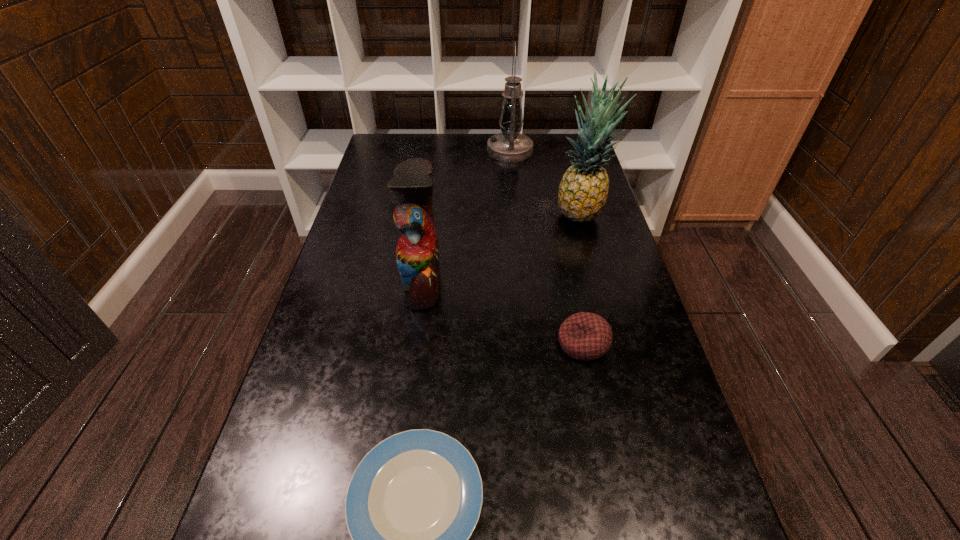
Locate an element on the screen. The image size is (960, 540). free space between the fourth farthest object and the pineapple is located at coordinates (581, 279).

This screenshot has width=960, height=540. In order to click on vacant area between the oil lamp and the third tallest object in this screenshot , I will do `click(467, 215)`.

Where is `vacant area between the farthest object and the fourth nearest object`? The image size is (960, 540). vacant area between the farthest object and the fourth nearest object is located at coordinates (544, 182).

At what (x,y) coordinates should I click in order to perform the action: click on vacant region between the fourth nearest object and the second nearest object. Please return your answer as a coordinate pair (x, y). This screenshot has height=540, width=960. Looking at the image, I should click on (581, 279).

Where is `free spot between the second farthest object and the beanbag`? free spot between the second farthest object and the beanbag is located at coordinates (581, 279).

Identify the location of object that is the third nearest to the third nearest object. (583, 190).

Where is `object that stands as the third closest to the beanbag`? The height and width of the screenshot is (540, 960). object that stands as the third closest to the beanbag is located at coordinates (583, 190).

Locate an element on the screen. The width and height of the screenshot is (960, 540). free space that satisfies the following two spatial constraints: 1. at the face of the third nearest object; 2. on the left side of the second shortest object is located at coordinates (414, 344).